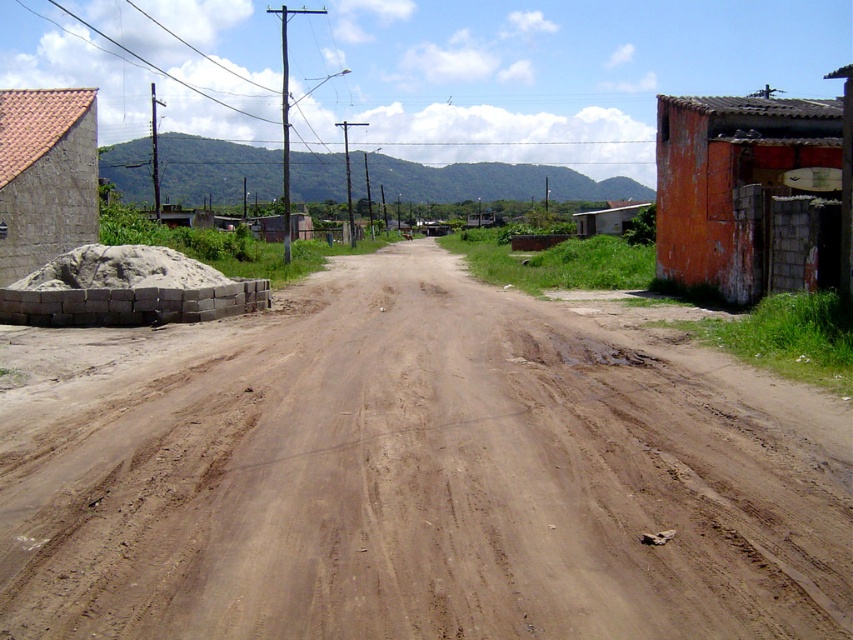
Question: Which point appears closest to the camera in this image?

Choices:
 (A) (601, 333)
 (B) (25, 134)

Answer: (A)

Question: Is orange painted concrete hut at right to the left of red tile roof at left from the viewer's perspective?

Choices:
 (A) no
 (B) yes

Answer: (A)

Question: Is orange painted concrete hut at right smaller than red tile roof at left?

Choices:
 (A) yes
 (B) no

Answer: (A)

Question: Which object is the farthest from the brown dirt field at center?

Choices:
 (A) orange painted concrete hut at right
 (B) red tile roof at left

Answer: (B)

Question: Which point appears closest to the camera in this image?

Choices:
 (A) (67, 154)
 (B) (751, 108)

Answer: (B)

Question: Is brown dirt field at center behind red tile roof at left?

Choices:
 (A) yes
 (B) no

Answer: (B)